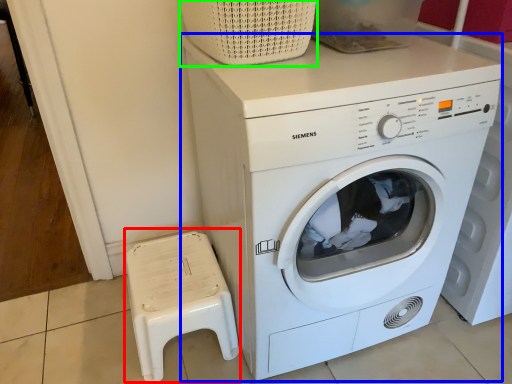
Question: Which object is positioned farthest from music stool (highlighted by a red box)? Select from washing machine (highlighted by a blue box) and basket (highlighted by a green box).

Choices:
 (A) washing machine
 (B) basket

Answer: (B)